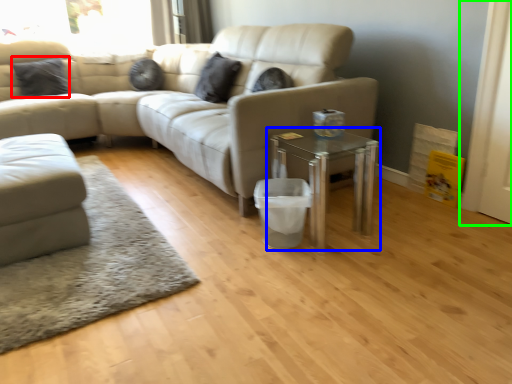
Question: Which is nearer to the pillow (highlighted by a red box)? table (highlighted by a blue box) or screen door (highlighted by a green box).

Choices:
 (A) table
 (B) screen door

Answer: (A)